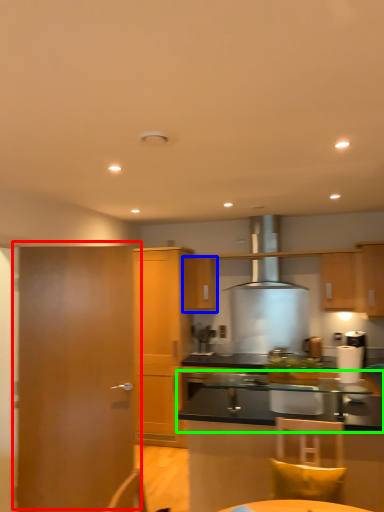
Question: Based on their relative distances, which object is farther from door (highlighted by a red box)? Choose from cabinetry (highlighted by a blue box) and countertop (highlighted by a green box).

Choices:
 (A) cabinetry
 (B) countertop

Answer: (A)